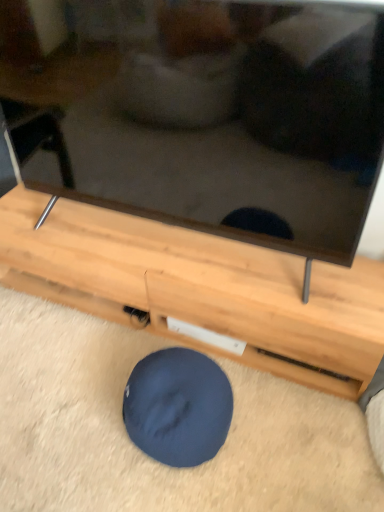
Image resolution: width=384 pixels, height=512 pixels. Identify the location of free point above dark blue fabric dog bed at lower center (from a real-world perspective). (180, 380).